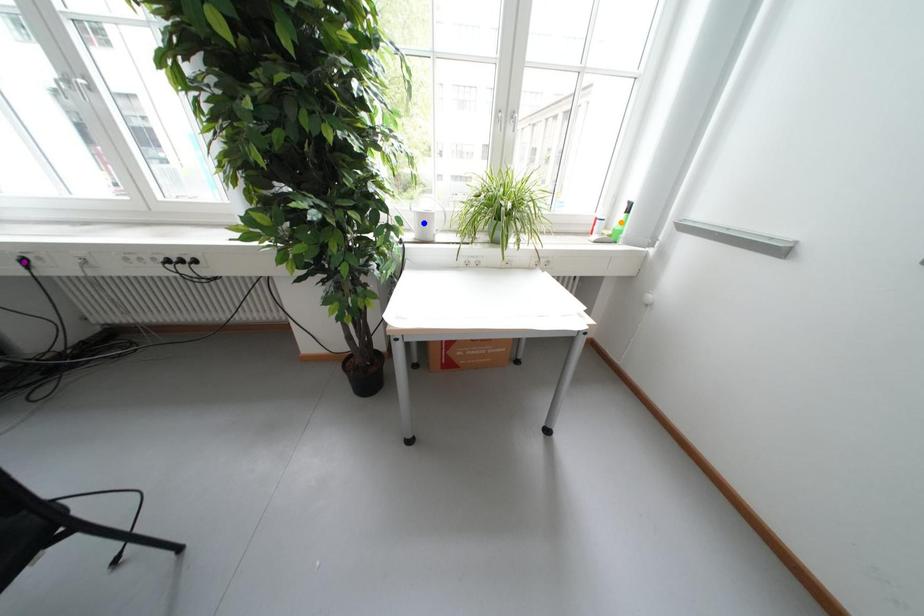
Order these from nearest to farthest:
orange point
blue point
purple point

purple point < blue point < orange point